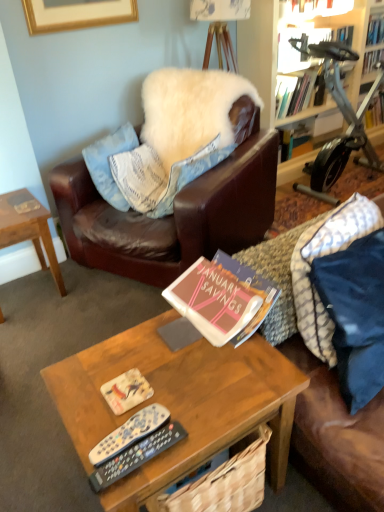
Where is `vacant area to the right of matte paper book cover at center`? The width and height of the screenshot is (384, 512). vacant area to the right of matte paper book cover at center is located at coordinates (199, 382).